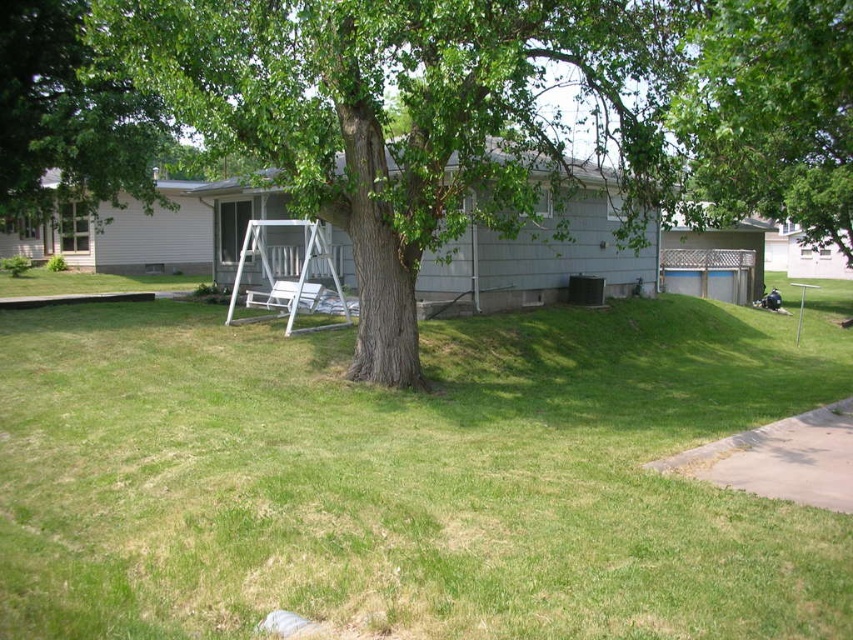
Is green grass at center shorter than green leafy tree at upper center?

Yes.

Who is shorter, green grass at center or green leafy tree at upper center?

green grass at center

Describe the element at coordinates (410, 477) in the screenshot. I see `green grass at center` at that location.

Image resolution: width=853 pixels, height=640 pixels. Find the location of `green grass at center`. green grass at center is located at coordinates (410, 477).

Is point (741, 173) closer to viewer compared to point (310, 310)?

No, (741, 173) is further to viewer.

How much distance is there between green leafy tree at upper center and white plastic chair at center?

green leafy tree at upper center is 36.39 feet from white plastic chair at center.

Where is `green leafy tree at upper center`? This screenshot has height=640, width=853. green leafy tree at upper center is located at coordinates (772, 113).

Where is `green leafy tree at upper center`? Image resolution: width=853 pixels, height=640 pixels. green leafy tree at upper center is located at coordinates (772, 113).

Does green rough bark tree at center appear on the right side of green leafy tree at upper center?

No, green rough bark tree at center is not to the right of green leafy tree at upper center.

Measure the distance between green rough bark tree at center and camera.

The distance of green rough bark tree at center from camera is 7.51 meters.

I want to click on green rough bark tree at center, so click(x=410, y=116).

Where is `green rough bark tree at center`? The image size is (853, 640). green rough bark tree at center is located at coordinates (410, 116).